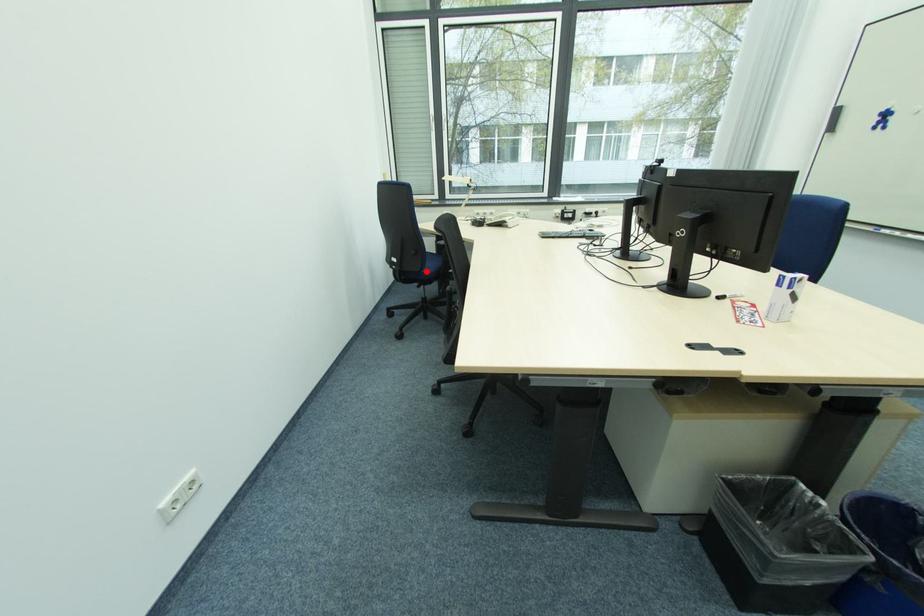
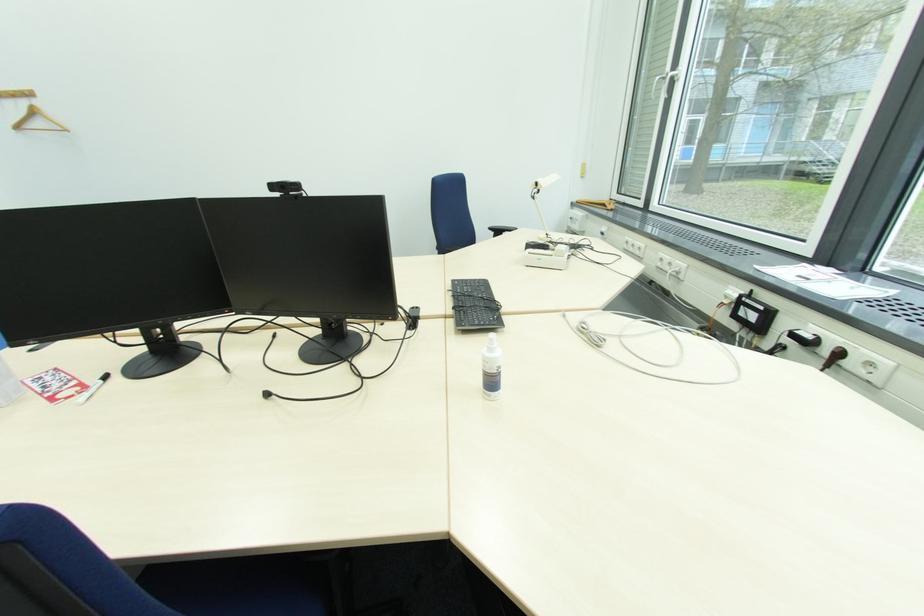
Question: I am providing you with two images of the same scene from different viewpoints. A red point is marked on the first image. Can you still see the location of the red point in image 2?

Choices:
 (A) Yes
 (B) No

Answer: (B)